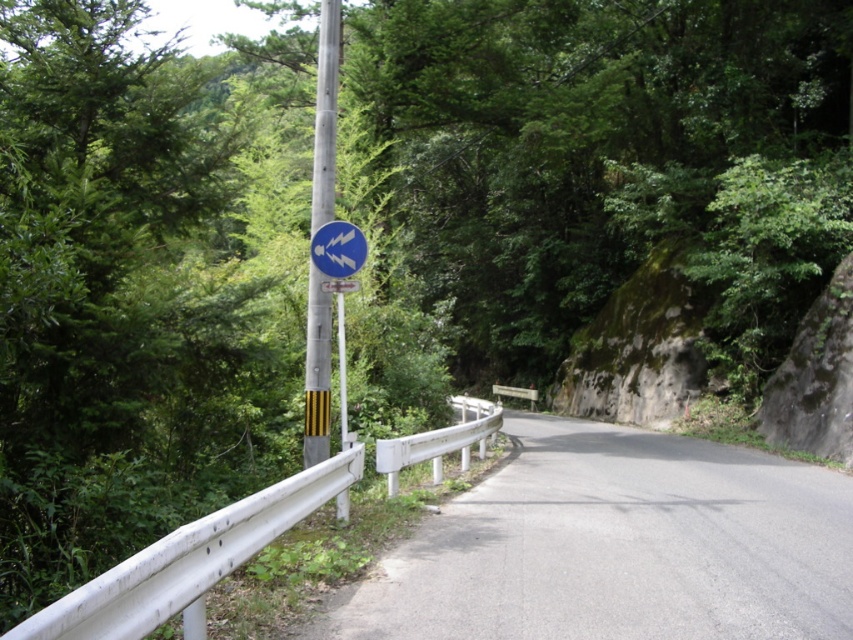
Question: Based on their relative distances, which object is nearer to the gray asphalt road at center?

Choices:
 (A) metallic pole at center
 (B) blue glossy sign at upper center

Answer: (B)

Question: Does metallic pole at center have a smaller size compared to blue glossy sign at upper center?

Choices:
 (A) yes
 (B) no

Answer: (A)

Question: Does gray asphalt road at center have a greater width compared to metallic pole at center?

Choices:
 (A) yes
 (B) no

Answer: (A)

Question: Among these points, which one is farthest from the camera?

Choices:
 (A) (334, 241)
 (B) (589, 632)
 (C) (316, 156)

Answer: (C)

Question: Which point is farther to the camera?

Choices:
 (A) (332, 100)
 (B) (792, 477)
 (C) (338, 237)

Answer: (B)

Question: Does gray asphalt road at center appear under blue glossy sign at upper center?

Choices:
 (A) yes
 (B) no

Answer: (A)